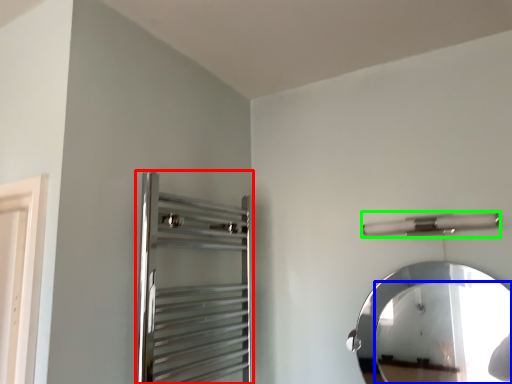
Question: Which is farther away from screen door (highlighted by a red box)? mirror (highlighted by a blue box) or towel bar (highlighted by a green box)?

Choices:
 (A) mirror
 (B) towel bar

Answer: (A)